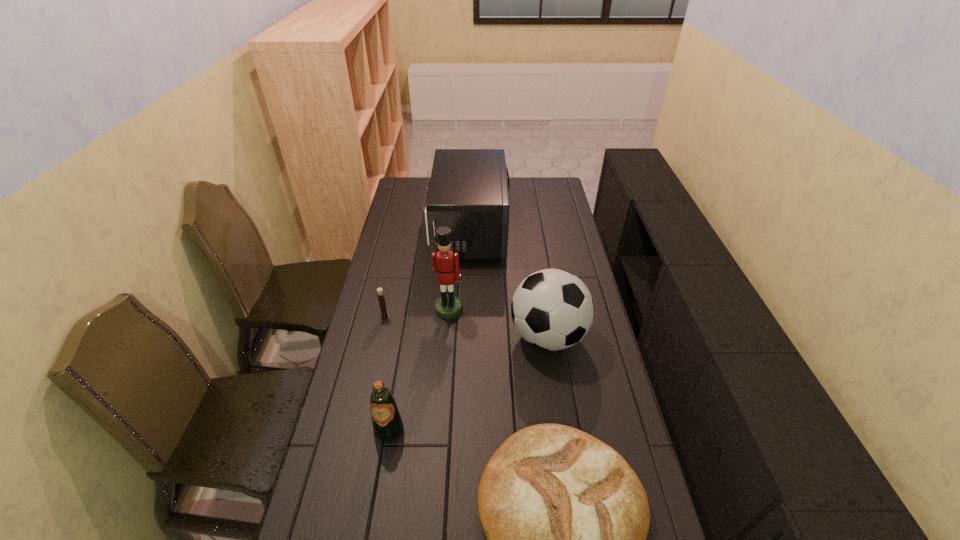
At what (x,y) coordinates should I click in order to perform the action: click on free space between the fourth tallest object and the soccer ball. Please return your answer as a coordinate pair (x, y). Looking at the image, I should click on (468, 382).

Locate an element on the screen. This screenshot has height=540, width=960. unoccupied position between the candle holder and the microwave oven is located at coordinates (428, 273).

Where is `unoccupied position between the candle holder and the third shortest object`? This screenshot has height=540, width=960. unoccupied position between the candle holder and the third shortest object is located at coordinates (387, 372).

What are the coordinates of `free spot between the fifth object from right to left and the candle holder` in the screenshot? It's located at (387, 372).

The image size is (960, 540). I want to click on empty space between the olive oil and the microwave oven, so [430, 329].

Where is `unoccupied area between the farthest object and the candle holder`? This screenshot has width=960, height=540. unoccupied area between the farthest object and the candle holder is located at coordinates (428, 273).

Select which object appears as the third closest to the soccer ball. Please provide its 2D coordinates. Your answer should be formatted as a tuple, i.e. [(x, y)], where the tuple contains the x and y coordinates of a point satisfying the conditions above.

[(468, 192)]

The height and width of the screenshot is (540, 960). I want to click on the fifth closest object to the tallest object, so click(x=566, y=518).

The height and width of the screenshot is (540, 960). Find the location of `free spot that satisfies the following two spatial constraints: 1. on the front-facing side of the microwave oven; 2. on the front-facing side of the nutcracker`. free spot that satisfies the following two spatial constraints: 1. on the front-facing side of the microwave oven; 2. on the front-facing side of the nutcracker is located at coordinates (468, 310).

Where is `free spot that satisfies the following two spatial constraints: 1. on the back side of the soccer ball; 2. on the front-facing side of the microwave oven`? The width and height of the screenshot is (960, 540). free spot that satisfies the following two spatial constraints: 1. on the back side of the soccer ball; 2. on the front-facing side of the microwave oven is located at coordinates (532, 230).